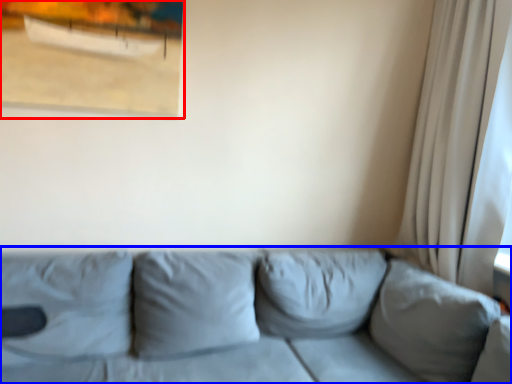
Question: Which point is further to the camera, picture frame (highlighted by a red box) or studio couch (highlighted by a blue box)?

Choices:
 (A) picture frame
 (B) studio couch

Answer: (A)